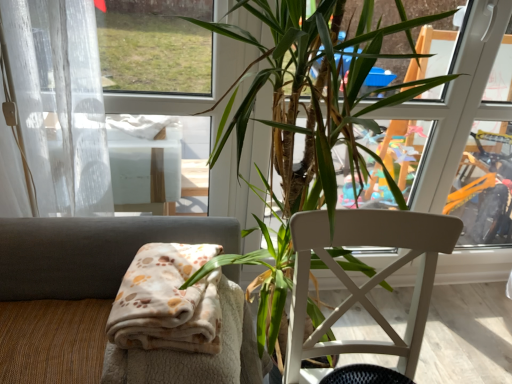
Question: Is beige fabric chair at lower left, the 2th chair when ordered from right to left, aimed at green leafy plant at center?

Choices:
 (A) no
 (B) yes

Answer: (A)

Question: Can you confirm if beige fabric chair at lower left, the 2th chair when ordered from right to left, is smaller than green leafy plant at center?

Choices:
 (A) no
 (B) yes

Answer: (B)

Question: Does beige fabric chair at lower left, the 1th chair viewed from the left, have a lesser width compared to green leafy plant at center?

Choices:
 (A) no
 (B) yes

Answer: (B)

Question: From the image's perspective, is beige fabric chair at lower left, the 2th chair when ordered from right to left, under green leafy plant at center?

Choices:
 (A) yes
 (B) no

Answer: (A)

Question: Is beige fabric chair at lower left, the 2th chair when ordered from right to left, taller than green leafy plant at center?

Choices:
 (A) no
 (B) yes

Answer: (A)

Question: From a real-world perspective, is green leafy plant at center physically located above or below white wood chair at center, which is counted as the first chair, starting from the right?

Choices:
 (A) above
 (B) below

Answer: (A)

Question: Is green leafy plant at center taller or shorter than white wood chair at center, which appears as the second chair when viewed from the left?

Choices:
 (A) short
 (B) tall

Answer: (B)

Question: Does point (224, 119) appear closer or farther from the camera than point (453, 246)?

Choices:
 (A) farther
 (B) closer

Answer: (A)

Question: Considering their positions, is green leafy plant at center located in front of or behind white wood chair at center, which is counted as the first chair, starting from the right?

Choices:
 (A) behind
 (B) front

Answer: (B)

Question: From a real-world perspective, relative to green leafy plant at center, is beige fabric chair at lower left, the 2th chair when ordered from right to left, vertically above or below?

Choices:
 (A) below
 (B) above

Answer: (A)

Question: From the image's perspective, relative to green leafy plant at center, is beige fabric chair at lower left, the 2th chair when ordered from right to left, above or below?

Choices:
 (A) below
 (B) above

Answer: (A)

Question: Is beige fabric chair at lower left, the 1th chair viewed from the left, in front of or behind green leafy plant at center in the image?

Choices:
 (A) front
 (B) behind

Answer: (B)

Question: Looking at the image, does beige fabric chair at lower left, the 2th chair when ordered from right to left, seem bigger or smaller compared to green leafy plant at center?

Choices:
 (A) big
 (B) small

Answer: (B)

Question: Based on their positions, is green leafy plant at center located to the left or right of beige fabric chair at lower left, the 1th chair viewed from the left?

Choices:
 (A) left
 (B) right

Answer: (B)

Question: Is green leafy plant at center bigger or smaller than beige fabric chair at lower left, the 1th chair viewed from the left?

Choices:
 (A) small
 (B) big

Answer: (B)